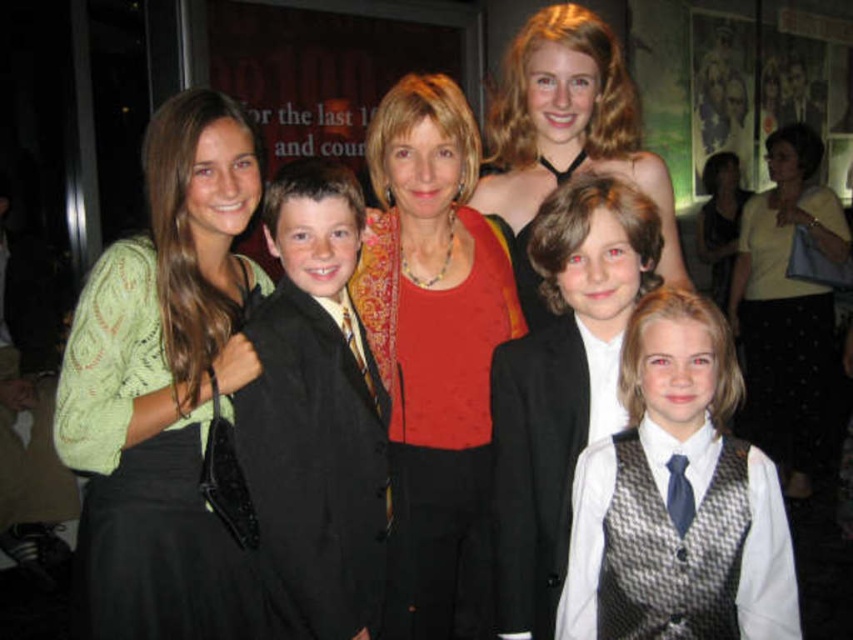
Question: Among these points, which one is farthest from the camera?

Choices:
 (A) (728, 264)
 (B) (729, 616)
 (C) (567, 323)
 (D) (758, 380)

Answer: (A)

Question: Considering the real-world distances, which object is closest to the matte black dress at center?

Choices:
 (A) red satin blouse at center
 (B) green textured sweater at left
 (C) black satin suit at center

Answer: (A)

Question: Estimate the real-world distances between objects in this image. Which object is closer to the white shirt with patterned vest at center?

Choices:
 (A) red satin blouse at center
 (B) black satin suit at center
 (C) matte black dress at center

Answer: (A)

Question: Is green textured sweater at left above silver textured vest at center?

Choices:
 (A) no
 (B) yes

Answer: (B)

Question: Is silver textured vest at center above black satin suit at center?

Choices:
 (A) yes
 (B) no

Answer: (B)

Question: Can you confirm if green textured sweater at left is positioned to the right of silver textured vest at center?

Choices:
 (A) yes
 (B) no

Answer: (B)